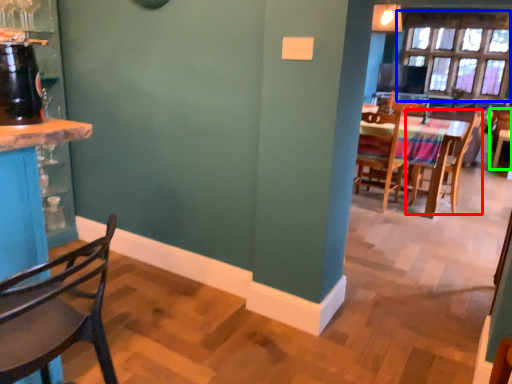
Question: Which is nearer to the chair (highlighted by a red box)? window (highlighted by a blue box) or chair (highlighted by a green box).

Choices:
 (A) window
 (B) chair

Answer: (B)